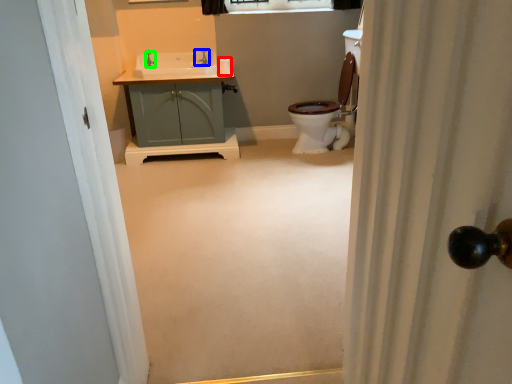
Question: Considering the real-world distances, which object is closest to toilet paper (highlighted by a red box)? tap (highlighted by a blue box) or faucet (highlighted by a green box).

Choices:
 (A) tap
 (B) faucet

Answer: (A)